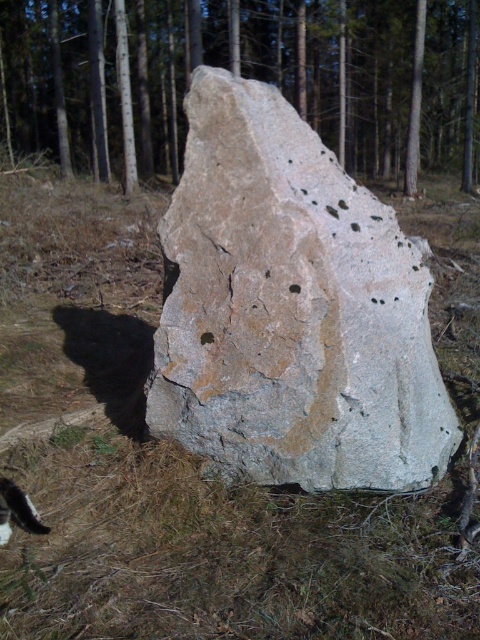
Can you confirm if brown rough rock at center is positioned above black fur cat at lower left?

Correct, brown rough rock at center is located above black fur cat at lower left.

Find the location of a particular element. brown rough rock at center is located at coordinates (x=357, y=72).

Is point (75, 132) in front of point (25, 528)?

No, it is not.

The image size is (480, 640). Identify the location of brown rough rock at center. (357, 72).

Who is shorter, speckled stone at center or brown rough rock at center?

Standing shorter between the two is speckled stone at center.

Is point (228, 141) behind point (392, 92)?

No, it is in front of (392, 92).

Measure the distance between speckled stone at center and camera.

speckled stone at center is 2.94 meters from camera.

In order to click on speckled stone at center in this screenshot , I will do `click(290, 308)`.

Between point (262, 396) and point (25, 513), which one is positioned behind?

The point (262, 396) is more distant.

Is speckled stone at center closer to the viewer compared to black fur cat at lower left?

No, speckled stone at center is further to the viewer.

Measure the distance between point (387, 336) and camera.

10.43 feet

I want to click on speckled stone at center, so click(290, 308).